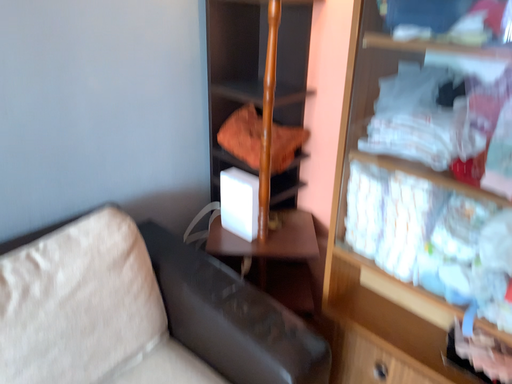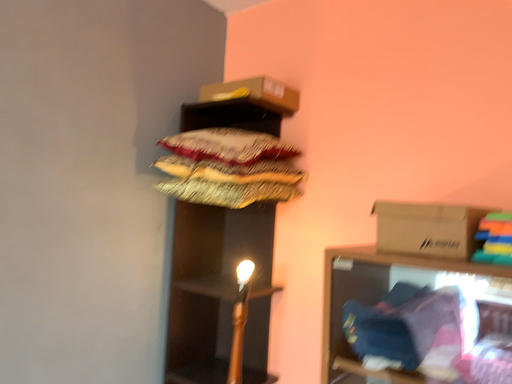
Question: Which way did the camera rotate in the video?

Choices:
 (A) rotated upward
 (B) rotated downward

Answer: (A)